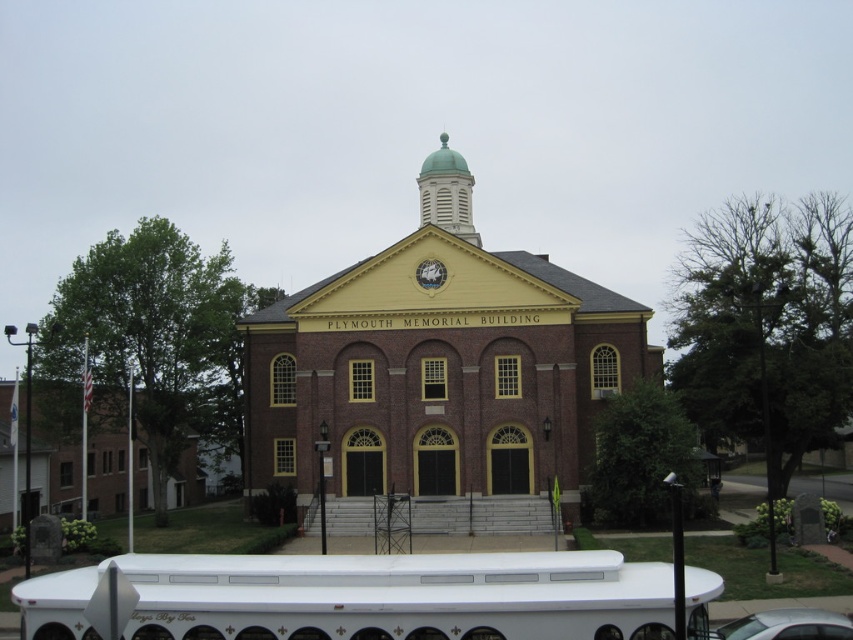
You are standing at point [444,150] and want to reach the entrance of the Plymouth Memorial Building. The entrance is located at the central part of the building. Considering the distance between your current position and the entrance, can you estimate whether you need to walk more than 100 meters to reach it?

The distance between point [444,150] and the entrance at the central part of the Plymouth Memorial Building is 111.61 meters, so yes, you need to walk more than 100 meters to reach it.